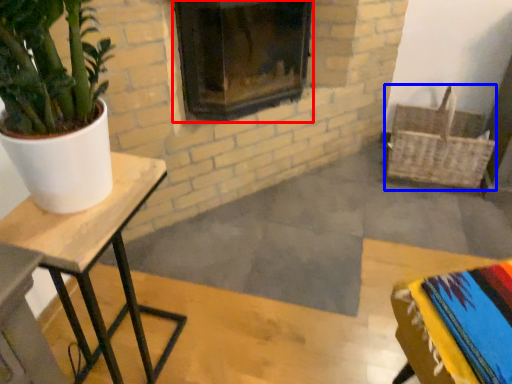
Question: Which object is closer to the camera taking this photo, fireplace (highlighted by a red box) or basket (highlighted by a blue box)?

Choices:
 (A) fireplace
 (B) basket

Answer: (A)